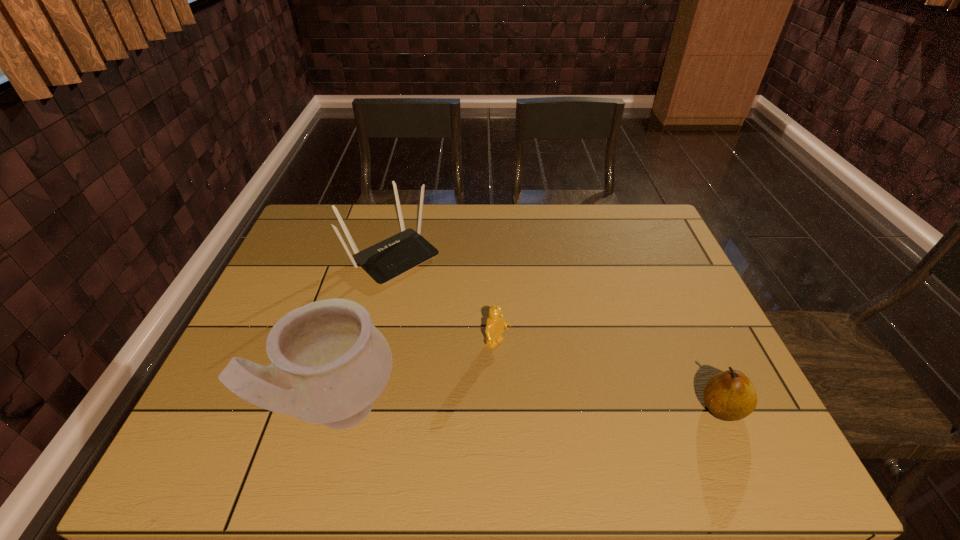
Locate an element on the screen. The height and width of the screenshot is (540, 960). free space located 0.070m on the face of the second farthest object is located at coordinates (530, 369).

Locate an element on the screen. The image size is (960, 540). vacant space located on the front-facing side of the second tallest object is located at coordinates (478, 327).

Where is `vacant point located 0.400m on the front-facing side of the second tallest object`? vacant point located 0.400m on the front-facing side of the second tallest object is located at coordinates (520, 362).

You are a GUI agent. You are given a task and a screenshot of the screen. Output one action in this format:
    pyautogui.click(x=<x>, y=<y>)
    Task: Click on the vacant space located 0.140m on the front-facing side of the second tallest object
    The image size is (960, 540).
    Given the screenshot: What is the action you would take?
    pyautogui.click(x=451, y=305)

Where is `object positioned at the far edge`? object positioned at the far edge is located at coordinates (392, 257).

Identify the location of pottery located in the near edge section of the desktop. This screenshot has height=540, width=960. (329, 363).

Image resolution: width=960 pixels, height=540 pixels. In order to click on pear that is positioned at the near edge in this screenshot , I will do `click(729, 395)`.

Locate an element on the screen. This screenshot has width=960, height=540. object that is at the left edge is located at coordinates (329, 363).

Where is `object positioned at the right edge`? object positioned at the right edge is located at coordinates (729, 395).

I want to click on object that is at the near left corner, so click(x=329, y=363).